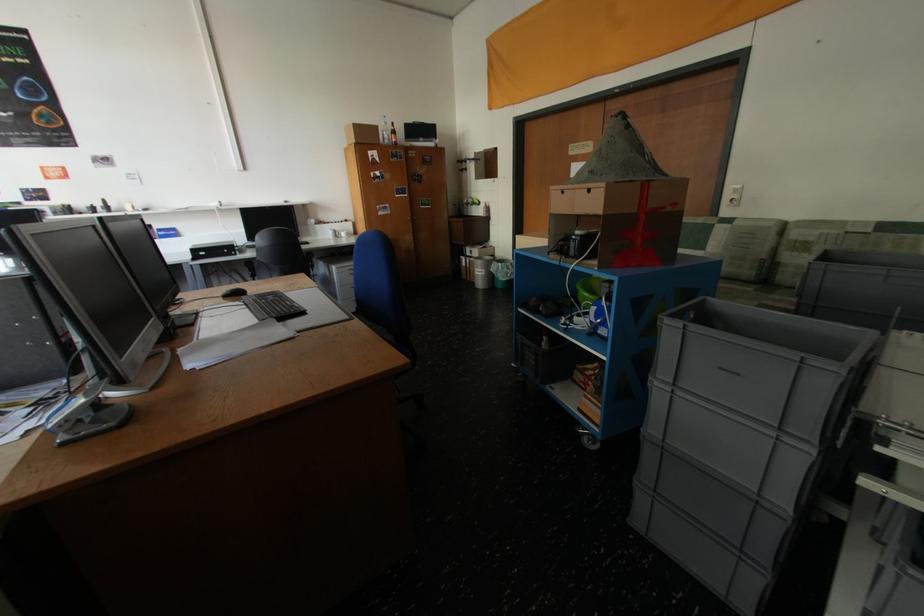
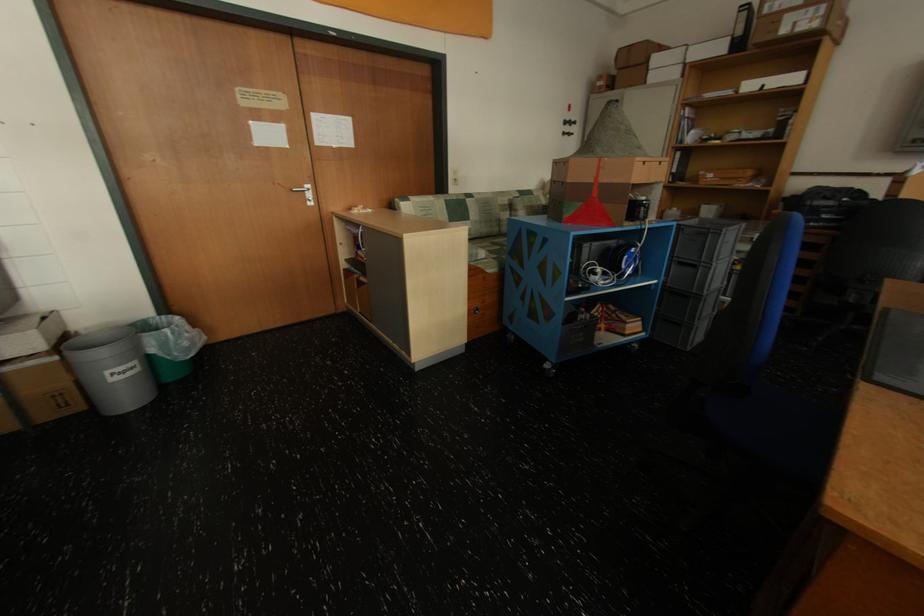
Where in the second image is the point corresponding to (492,272) from the first image?

(142, 363)